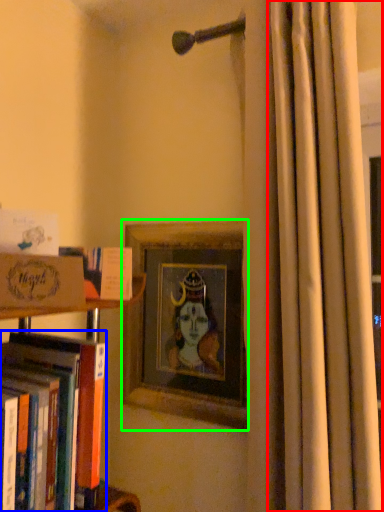
Question: Which is nearer to the curtain (highlighted by a red box)? book (highlighted by a blue box) or picture frame (highlighted by a green box).

Choices:
 (A) book
 (B) picture frame

Answer: (B)